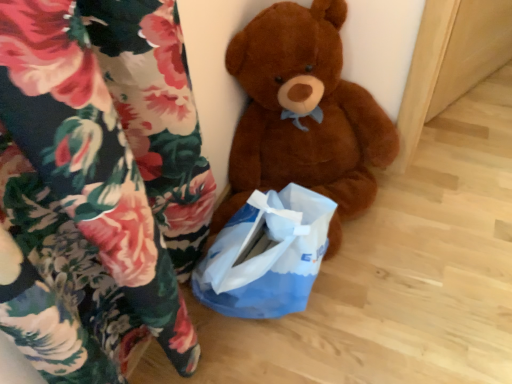
The width and height of the screenshot is (512, 384). What do you see at coordinates (303, 115) in the screenshot?
I see `brown plush teddy bear at center` at bounding box center [303, 115].

Where is `brown plush teddy bear at center`? brown plush teddy bear at center is located at coordinates (303, 115).

Image resolution: width=512 pixels, height=384 pixels. Identify the location of brown plush teddy bear at center. (303, 115).